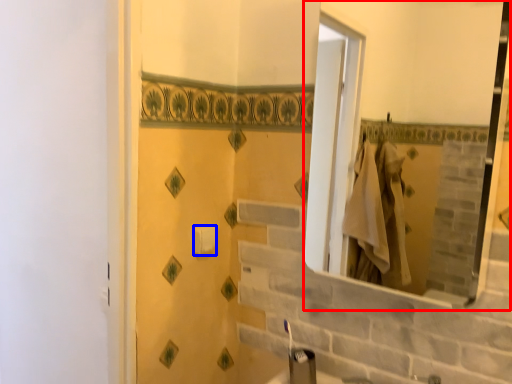
Question: Which object appears closest to the camera in this image, mirror (highlighted by a red box) or toilet paper (highlighted by a blue box)?

Choices:
 (A) mirror
 (B) toilet paper

Answer: (A)